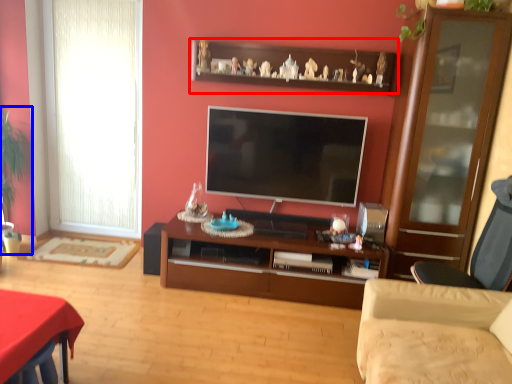
Question: Which object appears farthest to the camera in this image, shelf (highlighted by a red box) or plant (highlighted by a blue box)?

Choices:
 (A) shelf
 (B) plant

Answer: (B)